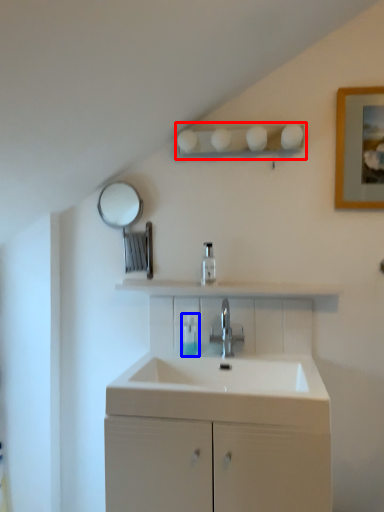
Question: Which object appears farthest to the camera in this image, shelf (highlighted by a red box) or toiletry (highlighted by a blue box)?

Choices:
 (A) shelf
 (B) toiletry

Answer: (B)